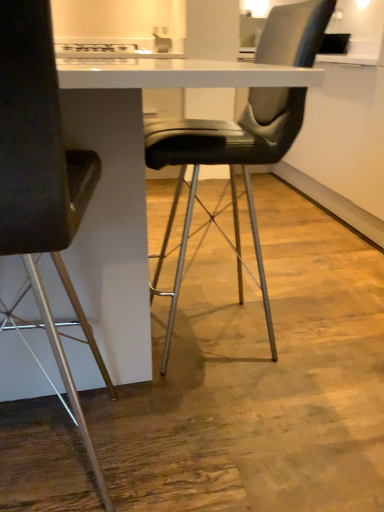
Question: Should I look upward or downward to see black leather chair at center, placed as the second chair when sorted from left to right?

Choices:
 (A) down
 (B) up

Answer: (B)

Question: From the image's perspective, is matte black chair at left, the 1th chair when ordered from left to right, under black leather chair at center, the first chair positioned from the right?

Choices:
 (A) no
 (B) yes

Answer: (B)

Question: Is matte black chair at left, which is the second chair in right-to-left order, outside of black leather chair at center, the first chair positioned from the right?

Choices:
 (A) yes
 (B) no

Answer: (A)

Question: From a real-world perspective, is matte black chair at left, the 1th chair when ordered from left to right, located higher than black leather chair at center, the first chair positioned from the right?

Choices:
 (A) yes
 (B) no

Answer: (B)

Question: Considering the relative sizes of matte black chair at left, which is the second chair in right-to-left order, and black leather chair at center, the first chair positioned from the right, in the image provided, is matte black chair at left, which is the second chair in right-to-left order, thinner than black leather chair at center, the first chair positioned from the right,?

Choices:
 (A) yes
 (B) no

Answer: (A)

Question: From the image's perspective, does matte black chair at left, the 1th chair when ordered from left to right, appear higher than black leather chair at center, placed as the second chair when sorted from left to right?

Choices:
 (A) yes
 (B) no

Answer: (B)

Question: Can you confirm if matte black chair at left, the 1th chair when ordered from left to right, is bigger than black leather chair at center, placed as the second chair when sorted from left to right?

Choices:
 (A) yes
 (B) no

Answer: (B)

Question: Is black leather chair at center, the first chair positioned from the right, placed right next to matte black chair at left, which is the second chair in right-to-left order?

Choices:
 (A) yes
 (B) no

Answer: (B)

Question: Could you tell me if black leather chair at center, the first chair positioned from the right, is facing matte black chair at left, the 1th chair when ordered from left to right?

Choices:
 (A) no
 (B) yes

Answer: (A)

Question: From the image's perspective, would you say black leather chair at center, placed as the second chair when sorted from left to right, is positioned over matte black chair at left, which is the second chair in right-to-left order?

Choices:
 (A) no
 (B) yes

Answer: (B)

Question: Would you say black leather chair at center, placed as the second chair when sorted from left to right, is outside matte black chair at left, the 1th chair when ordered from left to right?

Choices:
 (A) yes
 (B) no

Answer: (A)

Question: Does black leather chair at center, the first chair positioned from the right, appear on the left side of matte black chair at left, the 1th chair when ordered from left to right?

Choices:
 (A) yes
 (B) no

Answer: (B)

Question: Does black leather chair at center, the first chair positioned from the right, have a greater width compared to matte black chair at left, the 1th chair when ordered from left to right?

Choices:
 (A) no
 (B) yes

Answer: (B)

Question: Is black leather chair at center, the first chair positioned from the right, wider or thinner than matte black chair at left, which is the second chair in right-to-left order?

Choices:
 (A) thin
 (B) wide

Answer: (B)